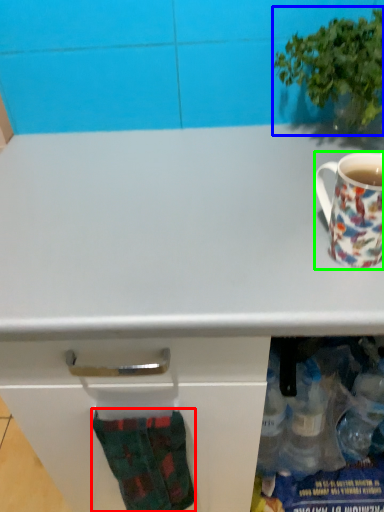
Question: Which object is the closest to the sock (highlighted by a red box)? Choose among these: houseplant (highlighted by a blue box) or coffee cup (highlighted by a green box).

Choices:
 (A) houseplant
 (B) coffee cup

Answer: (B)